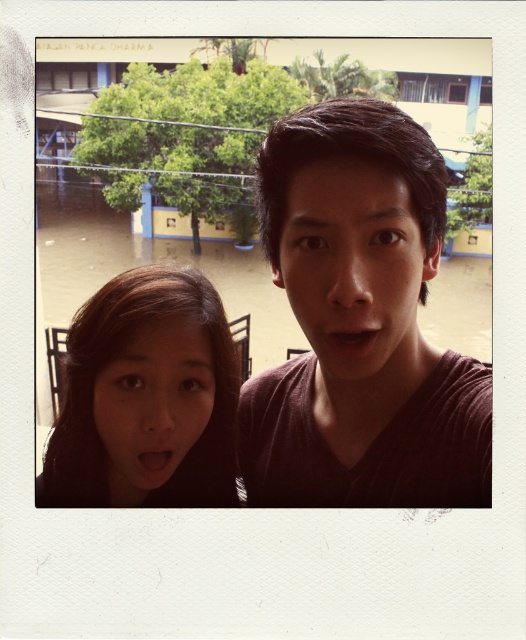
Question: Which object is farther from the camera taking this photo?

Choices:
 (A) brown hair at lower left
 (B) dark brown matte shirt at upper right
 (C) matte brown face at center

Answer: (A)

Question: Does brown hair at lower left have a larger size compared to matte brown face at center?

Choices:
 (A) no
 (B) yes

Answer: (B)

Question: Based on their relative distances, which object is farther from the brown hair at lower left?

Choices:
 (A) matte skin face at center
 (B) dark brown matte shirt at upper right
 (C) matte brown face at center

Answer: (C)

Question: Among these objects, which one is farthest from the camera?

Choices:
 (A) matte brown face at center
 (B) matte skin face at center
 (C) dark brown matte shirt at upper right
 (D) brown hair at lower left

Answer: (B)

Question: Considering the relative positions of matte brown face at center and matte skin face at center in the image provided, where is matte brown face at center located with respect to matte skin face at center?

Choices:
 (A) above
 (B) below

Answer: (A)

Question: Can you confirm if dark brown matte shirt at upper right is positioned below matte brown face at center?

Choices:
 (A) no
 (B) yes

Answer: (B)